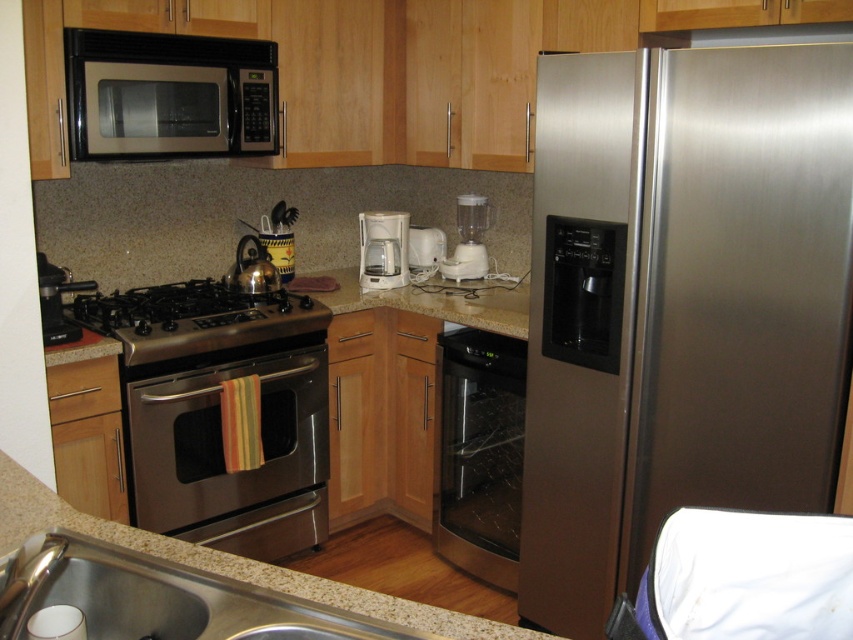
I want to click on granite countertop at lower left, so click(x=225, y=563).

Measure the distance between point (27, 499) and camera.

The distance of point (27, 499) from camera is 4.57 feet.

At what (x,y) coordinates should I click in order to perform the action: click on granite countertop at lower left. Please return your answer as a coordinate pair (x, y). Looking at the image, I should click on (225, 563).

This screenshot has height=640, width=853. In order to click on granite countertop at lower left in this screenshot , I will do `click(225, 563)`.

Who is shorter, stainless steel refrigerator at right or brushed metal coffee maker at left?

brushed metal coffee maker at left

Is point (561, 426) behind point (77, 333)?

No, (561, 426) is closer to viewer.

Is point (579, 454) less distant than point (51, 324)?

That is True.

Where is `stainless steel refrigerator at right`? stainless steel refrigerator at right is located at coordinates coord(680,305).

Is black/stainless steel microwave at upper center further to camera compared to white plastic coffee maker at center?

No, it is not.

Measure the distance between point (265,116) and camera.

They are 9.32 feet apart.

Describe the element at coordinates (167, 96) in the screenshot. This screenshot has height=640, width=853. I see `black/stainless steel microwave at upper center` at that location.

Find the location of a particular element. The width and height of the screenshot is (853, 640). black/stainless steel microwave at upper center is located at coordinates (167, 96).